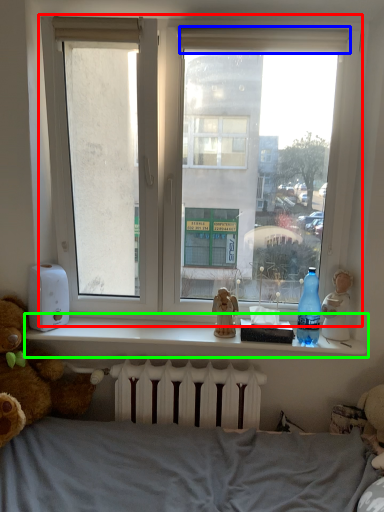
Question: Which object is the farthest from window (highlighted by a red box)? Choose among these: curtain (highlighted by a blue box) or window sill (highlighted by a green box).

Choices:
 (A) curtain
 (B) window sill

Answer: (B)